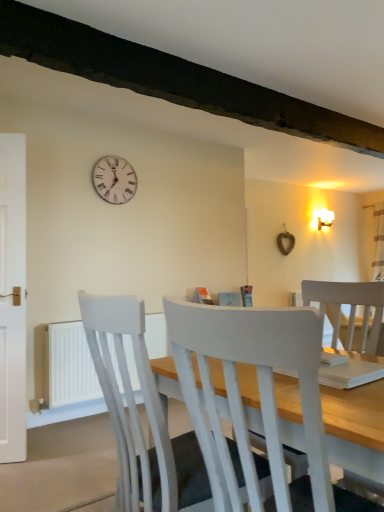
Question: Does white painted wood chair at center, marked as the first chair in a front-to-back arrangement, contain white painted wood chair at center, which is the first chair in back-to-front order?

Choices:
 (A) yes
 (B) no

Answer: (B)

Question: Considering the relative sizes of white painted wood chair at center, marked as the first chair in a front-to-back arrangement, and white painted wood chair at center, which is the first chair in back-to-front order, in the image provided, is white painted wood chair at center, marked as the first chair in a front-to-back arrangement, bigger than white painted wood chair at center, which is the first chair in back-to-front order,?

Choices:
 (A) no
 (B) yes

Answer: (A)

Question: Does white painted wood chair at center, placed as the second chair when sorted from back to front, lie in front of white painted wood chair at center, the second chair from the front?

Choices:
 (A) no
 (B) yes

Answer: (B)

Question: Would you say white painted wood chair at center, placed as the second chair when sorted from back to front, is outside white painted wood chair at center, the second chair from the front?

Choices:
 (A) yes
 (B) no

Answer: (A)

Question: From the image's perspective, is white painted wood chair at center, marked as the first chair in a front-to-back arrangement, located beneath white painted wood chair at center, which is the first chair in back-to-front order?

Choices:
 (A) yes
 (B) no

Answer: (B)

Question: In terms of width, does white wooden clock at upper center look wider or thinner when compared to white painted wood chair at center, the second chair from the front?

Choices:
 (A) wide
 (B) thin

Answer: (B)

Question: In the image, is white wooden clock at upper center positioned in front of or behind white painted wood chair at center, the second chair from the front?

Choices:
 (A) behind
 (B) front

Answer: (A)

Question: Considering the positions of white wooden clock at upper center and white painted wood chair at center, the second chair from the front, in the image, is white wooden clock at upper center taller or shorter than white painted wood chair at center, the second chair from the front,?

Choices:
 (A) tall
 (B) short

Answer: (B)

Question: From a real-world perspective, is white wooden clock at upper center physically located above or below white painted wood chair at center, the second chair from the front?

Choices:
 (A) above
 (B) below

Answer: (A)

Question: Would you say white painted wood chair at center, placed as the second chair when sorted from back to front, is inside or outside white painted wood chair at center, which is the first chair in back-to-front order?

Choices:
 (A) outside
 (B) inside

Answer: (A)

Question: In the image, is white painted wood chair at center, placed as the second chair when sorted from back to front, positioned in front of or behind white painted wood chair at center, which is the first chair in back-to-front order?

Choices:
 (A) behind
 (B) front

Answer: (B)

Question: Is point (309, 374) positioned closer to the camera than point (188, 504)?

Choices:
 (A) closer
 (B) farther

Answer: (A)

Question: From a real-world perspective, is white painted wood chair at center, marked as the first chair in a front-to-back arrangement, positioned above or below white painted wood chair at center, the second chair from the front?

Choices:
 (A) below
 (B) above

Answer: (B)

Question: Looking at their shapes, would you say white painted wood chair at center, which is the first chair in back-to-front order, is wider or thinner than white plastic radiator at lower left?

Choices:
 (A) wide
 (B) thin

Answer: (A)

Question: Looking at the image, does white painted wood chair at center, the second chair from the front, seem bigger or smaller compared to white plastic radiator at lower left?

Choices:
 (A) big
 (B) small

Answer: (A)